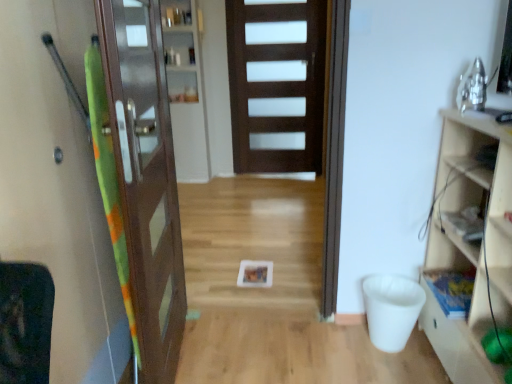
Question: Which direction should I rotate to look at clear glass cabinet at center, which ranks as the 2th shelf in bottom-to-top order, — up or down?

Choices:
 (A) up
 (B) down

Answer: (A)

Question: Is the depth of clear glass cabinet at center, which ranks as the 2th shelf in bottom-to-top order, less than that of dark wood door at center, which is the second door from front to back?

Choices:
 (A) yes
 (B) no

Answer: (A)

Question: Would you consider clear glass cabinet at center, which ranks as the second shelf in front-to-back order, to be distant from dark wood door at center, arranged as the first door when viewed from the right?

Choices:
 (A) no
 (B) yes

Answer: (A)

Question: Can you confirm if clear glass cabinet at center, which is counted as the 1th shelf, starting from the left, is wider than dark wood door at center, which is the second door from front to back?

Choices:
 (A) yes
 (B) no

Answer: (A)

Question: Considering the relative sizes of clear glass cabinet at center, positioned as the 1th shelf in top-to-bottom order, and dark wood door at center, which is the second door from front to back, in the image provided, is clear glass cabinet at center, positioned as the 1th shelf in top-to-bottom order, thinner than dark wood door at center, which is the second door from front to back,?

Choices:
 (A) yes
 (B) no

Answer: (B)

Question: Can you confirm if clear glass cabinet at center, which ranks as the second shelf in front-to-back order, is positioned to the left of dark wood door at center, acting as the 2th door starting from the left?

Choices:
 (A) yes
 (B) no

Answer: (A)

Question: Considering the relative sizes of clear glass cabinet at center, which ranks as the 2th shelf in bottom-to-top order, and dark wood door at center, arranged as the first door when viewed from the right, in the image provided, is clear glass cabinet at center, which ranks as the 2th shelf in bottom-to-top order, shorter than dark wood door at center, arranged as the first door when viewed from the right,?

Choices:
 (A) no
 (B) yes

Answer: (A)

Question: Considering the relative positions of dark wood door at center, which is the second door from front to back, and clear glass cabinet at center, which is the 2th shelf in right-to-left order, in the image provided, is dark wood door at center, which is the second door from front to back, to the right of clear glass cabinet at center, which is the 2th shelf in right-to-left order, from the viewer's perspective?

Choices:
 (A) no
 (B) yes

Answer: (B)

Question: From a real-world perspective, is dark wood door at center, which is the second door from front to back, positioned over clear glass cabinet at center, which ranks as the second shelf in front-to-back order, based on gravity?

Choices:
 (A) no
 (B) yes

Answer: (B)

Question: Does dark wood door at center, arranged as the first door when viewed from the right, appear on the left side of clear glass cabinet at center, which is the 2th shelf in right-to-left order?

Choices:
 (A) no
 (B) yes

Answer: (A)

Question: Does dark wood door at center, acting as the 2th door starting from the left, have a lesser height compared to clear glass cabinet at center, which ranks as the 2th shelf in bottom-to-top order?

Choices:
 (A) no
 (B) yes

Answer: (B)

Question: Is dark wood door at center, acting as the 2th door starting from the left, aimed at clear glass cabinet at center, which is counted as the 1th shelf, starting from the left?

Choices:
 (A) yes
 (B) no

Answer: (B)

Question: Is dark wood door at center, acting as the 1th door starting from the back, positioned with its back to clear glass cabinet at center, which is counted as the 1th shelf, starting from the left?

Choices:
 (A) yes
 (B) no

Answer: (B)

Question: Considering the relative sizes of clear glass cabinet at center, which is counted as the 1th shelf, starting from the left, and green fabric screen door at left in the image provided, is clear glass cabinet at center, which is counted as the 1th shelf, starting from the left, bigger than green fabric screen door at left?

Choices:
 (A) yes
 (B) no

Answer: (B)